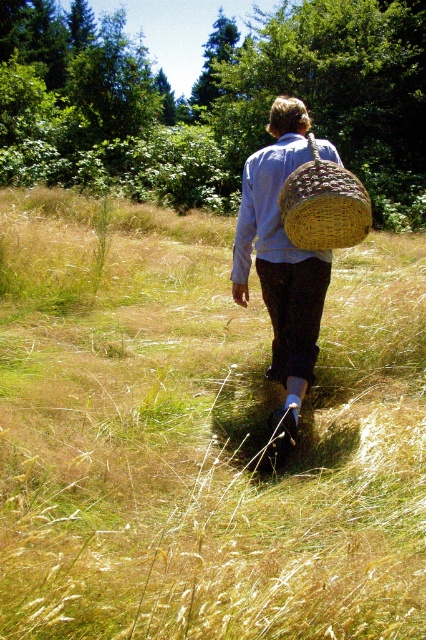
Question: Which object is farther from the camera taking this photo?

Choices:
 (A) woven straw basket at upper center
 (B) golden dry grass at center
 (C) woven straw basket at center
 (D) light blue woven shirt at center

Answer: (C)

Question: Is woven straw basket at center above light blue woven shirt at center?

Choices:
 (A) no
 (B) yes

Answer: (A)

Question: Which point is closer to the camera?

Choices:
 (A) light blue woven shirt at center
 (B) woven straw basket at center

Answer: (A)

Question: Is golden dry grass at center behind woven straw basket at center?

Choices:
 (A) yes
 (B) no

Answer: (B)

Question: From the image, what is the correct spatial relationship of golden dry grass at center in relation to woven straw basket at upper center?

Choices:
 (A) right
 (B) left

Answer: (B)

Question: Which object is the closest to the golden dry grass at center?

Choices:
 (A) light blue woven shirt at center
 (B) woven straw basket at center

Answer: (B)